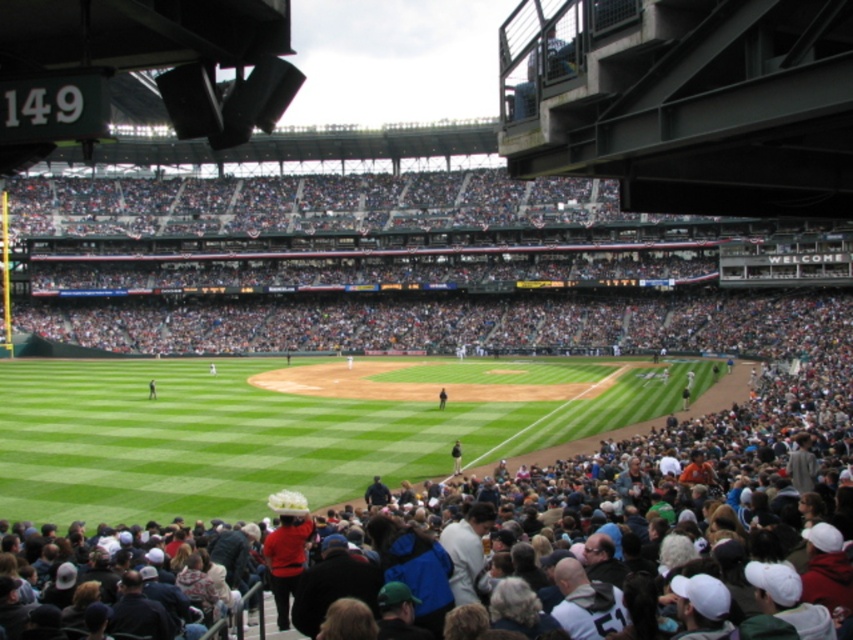
You are a photographer positioned at the center of the stadium and want to take a photo that includes both the point at (451, 445) and the point at (442, 388). Which point is closer to your camera?

Point at (451, 445) is closer to the viewer than point at (442, 388).

You are a spectator sitting in the stands and want to hand a hot dog to the person wearing the dark blue jacket at center. Can you reach them without moving from your seat, considering their position relative to the dark blue jersey at center?

A: The dark blue jacket at center is in front of the dark blue jersey at center, so you can likely reach them without moving from your seat since they are closer to you than the jersey wearer.